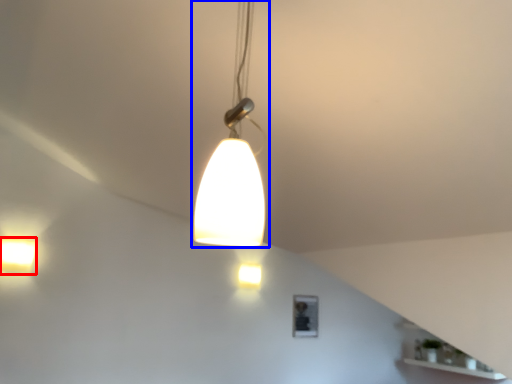
Question: Among these objects, which one is nearest to the camera, lamp (highlighted by a red box) or lamp (highlighted by a blue box)?

Choices:
 (A) lamp
 (B) lamp

Answer: (B)